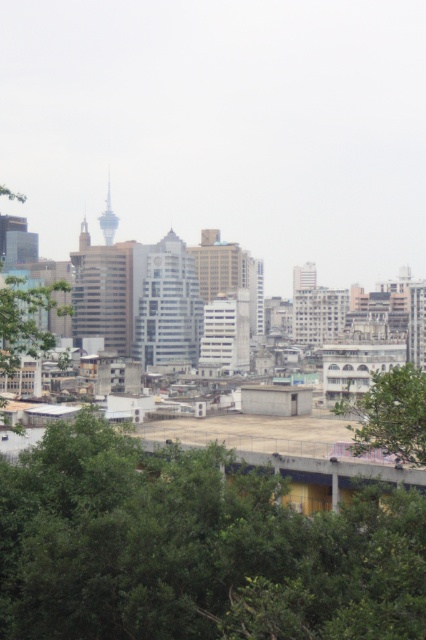
You are standing at the point marked by the coordinates point (195, 547), which is green leafy tree at lower center. Looking towards the city skyline, what is the first building you would see?

The first building you would see when looking towards the city skyline from the point marked by point (195, 547), which is green leafy tree at lower center would be the skyscraper with a spire at the top, as it is the most prominent and tallest structure in the skyline.